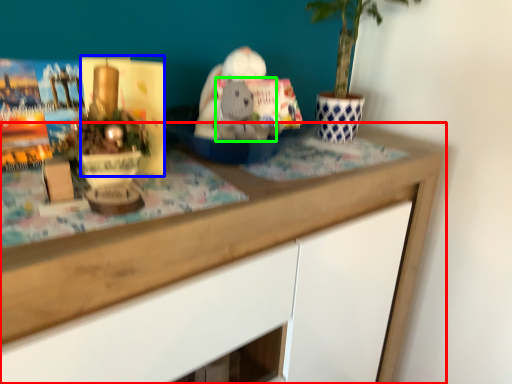
Question: Estimate the real-world distances between objects in this image. Which object is farther from desk (highlighted by a red box), paperback book (highlighted by a blue box) or animal (highlighted by a green box)?

Choices:
 (A) paperback book
 (B) animal

Answer: (A)